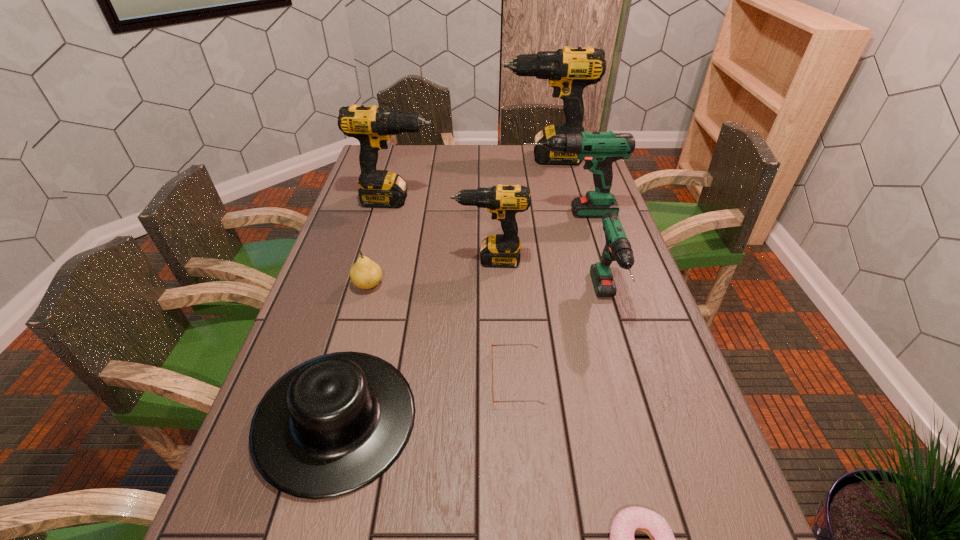
At what (x,y) coordinates should I click in order to perform the action: click on vacant area that lies between the black dress hat and the pear. Please return your answer as a coordinate pair (x, y). Looking at the image, I should click on (352, 352).

This screenshot has height=540, width=960. I want to click on vacant area that lies between the farthest drill and the black dress hat, so click(x=441, y=288).

The height and width of the screenshot is (540, 960). What are the coordinates of `vacant space that is in between the smallest black drill and the leftmost drill` in the screenshot? It's located at (443, 230).

Identify which object is located as the sixth nearest to the sunglasses. Please provide its 2D coordinates. Your answer should be formatted as a tuple, i.e. [(x, y)], where the tuple contains the x and y coordinates of a point satisfying the conditions above.

[(599, 150)]

Point out which object is positioned as the fourth nearest to the second smallest black drill. Please provide its 2D coordinates. Your answer should be formatted as a tuple, i.e. [(x, y)], where the tuple contains the x and y coordinates of a point satisfying the conditions above.

[(365, 274)]

Where is `drill object that ranks as the second closest to the farther green drill`? This screenshot has width=960, height=540. drill object that ranks as the second closest to the farther green drill is located at coordinates (618, 248).

The image size is (960, 540). Find the location of `drill that stands as the closest to the bigger green drill`. drill that stands as the closest to the bigger green drill is located at coordinates (x=501, y=250).

Identify which black drill is the closest to the black dress hat. Please provide its 2D coordinates. Your answer should be formatted as a tuple, i.e. [(x, y)], where the tuple contains the x and y coordinates of a point satisfying the conditions above.

[(501, 250)]

What are the coordinates of `black drill that can be found as the second closest to the doughnut` in the screenshot? It's located at pos(372,126).

Locate an element on the screen. blank space that satisfies the following two spatial constraints: 1. on the handle side of the fifth shortest object; 2. on the face of the sunglasses is located at coordinates (630, 378).